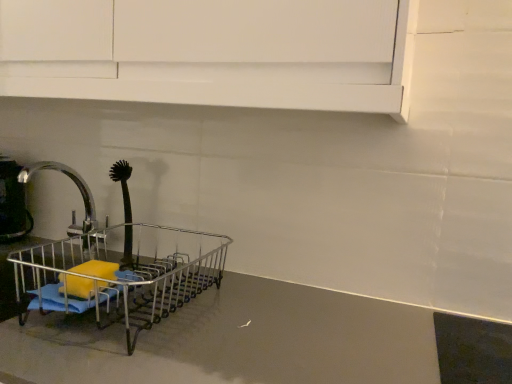
Question: Can you confirm if silver metallic faucet at left is taller than black rubber brush at left?

Choices:
 (A) yes
 (B) no

Answer: (B)

Question: Can you confirm if silver metallic faucet at left is wider than black rubber brush at left?

Choices:
 (A) yes
 (B) no

Answer: (A)

Question: Is silver metallic faucet at left at the right side of black rubber brush at left?

Choices:
 (A) no
 (B) yes

Answer: (A)

Question: Is silver metallic faucet at left surrounding black rubber brush at left?

Choices:
 (A) no
 (B) yes

Answer: (A)

Question: From a real-world perspective, is silver metallic faucet at left physically below black rubber brush at left?

Choices:
 (A) yes
 (B) no

Answer: (A)

Question: Considering the positions of metallic silver dish rack at left and silver metallic faucet at left in the image, is metallic silver dish rack at left bigger or smaller than silver metallic faucet at left?

Choices:
 (A) big
 (B) small

Answer: (A)

Question: From the image's perspective, relative to silver metallic faucet at left, is metallic silver dish rack at left above or below?

Choices:
 (A) below
 (B) above

Answer: (A)

Question: In terms of height, does metallic silver dish rack at left look taller or shorter compared to silver metallic faucet at left?

Choices:
 (A) short
 (B) tall

Answer: (A)

Question: From a real-world perspective, is metallic silver dish rack at left above or below silver metallic faucet at left?

Choices:
 (A) below
 (B) above

Answer: (A)

Question: Is silver metallic faucet at left situated inside metallic silver kettle at left or outside?

Choices:
 (A) inside
 (B) outside

Answer: (B)

Question: From their relative heights in the image, would you say silver metallic faucet at left is taller or shorter than metallic silver kettle at left?

Choices:
 (A) short
 (B) tall

Answer: (B)

Question: From the image's perspective, is silver metallic faucet at left located above or below metallic silver kettle at left?

Choices:
 (A) below
 (B) above

Answer: (A)

Question: From a real-world perspective, relative to metallic silver kettle at left, is silver metallic faucet at left vertically above or below?

Choices:
 (A) below
 (B) above

Answer: (A)

Question: Choose the correct answer: Is black rubber brush at left inside metallic silver dish rack at left or outside it?

Choices:
 (A) outside
 (B) inside

Answer: (A)

Question: From the image's perspective, is black rubber brush at left located above or below metallic silver dish rack at left?

Choices:
 (A) above
 (B) below

Answer: (A)